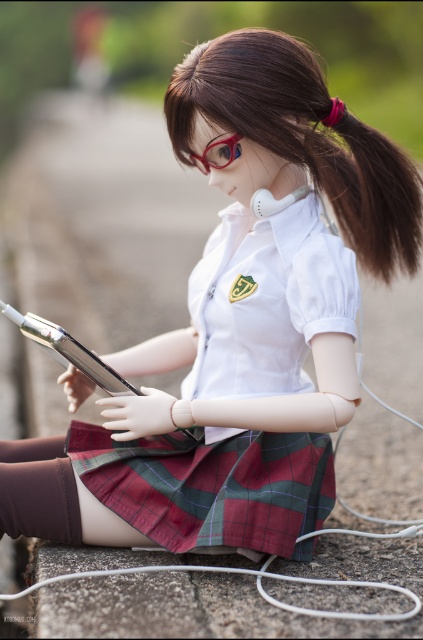
Question: Is brown silky hair at upper center to the left of brown silky hair at upper right from the viewer's perspective?

Choices:
 (A) yes
 (B) no

Answer: (A)

Question: Is brown silky hair at upper center closer to camera compared to plaid fabric kilt at center?

Choices:
 (A) no
 (B) yes

Answer: (B)

Question: Considering the real-world distances, which object is farthest from the brown silky hair at upper center?

Choices:
 (A) plaid fabric kilt at center
 (B) translucent blue goggles at center

Answer: (A)

Question: Observing the image, what is the correct spatial positioning of brown silky hair at upper center in reference to translucent blue goggles at center?

Choices:
 (A) left
 (B) right

Answer: (B)

Question: Which of the following is the closest to the observer?

Choices:
 (A) (227, 84)
 (B) (371, 240)
 (C) (222, 141)

Answer: (A)

Question: Which object is the farthest from the brown silky hair at upper right?

Choices:
 (A) translucent blue goggles at center
 (B) brown silky hair at upper center
 (C) plaid fabric kilt at center

Answer: (C)